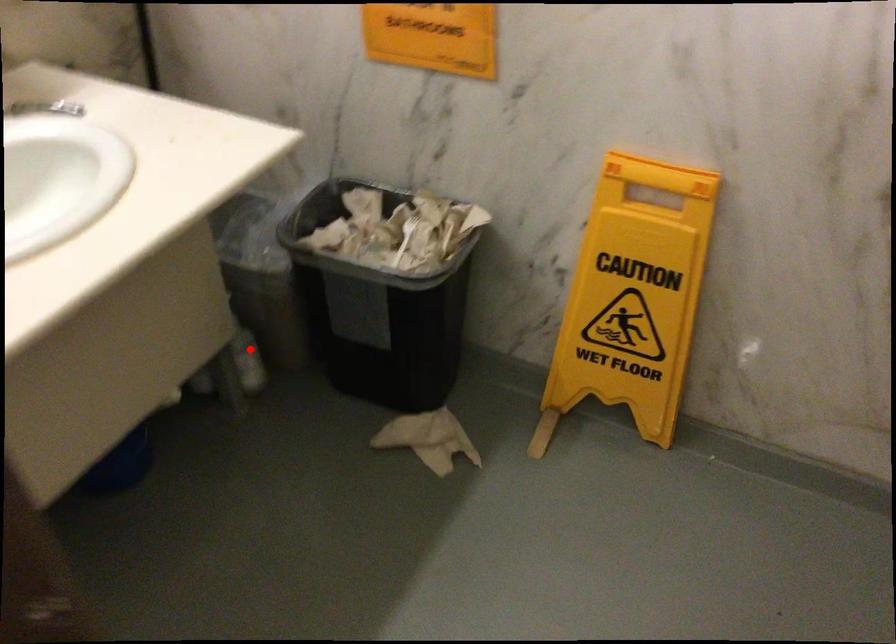
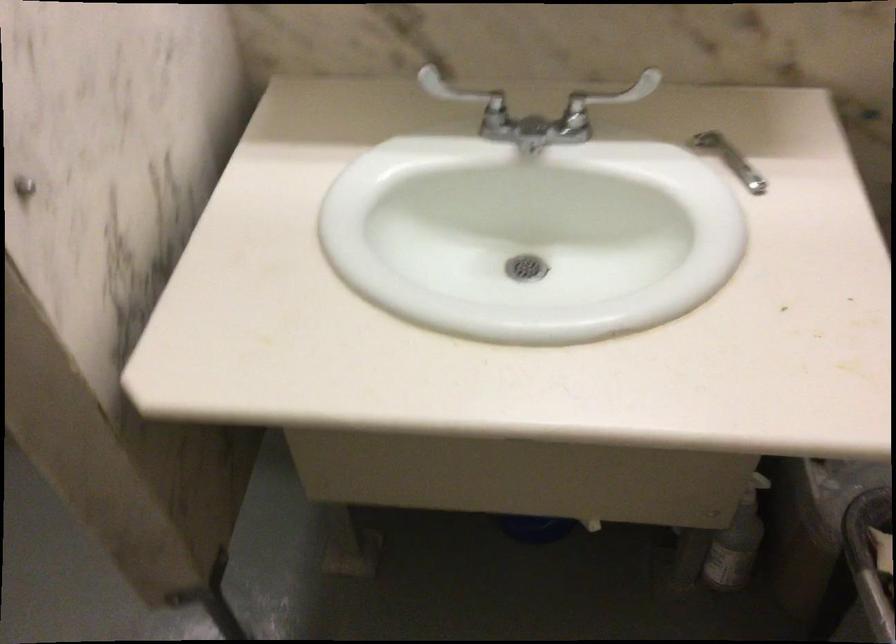
Question: I am providing you with two images of the same scene from different viewpoints. A red point is shown in image1. For the corresponding object point in image2, is it positioned nearer or farther from the camera?

Choices:
 (A) Nearer
 (B) Farther

Answer: (A)